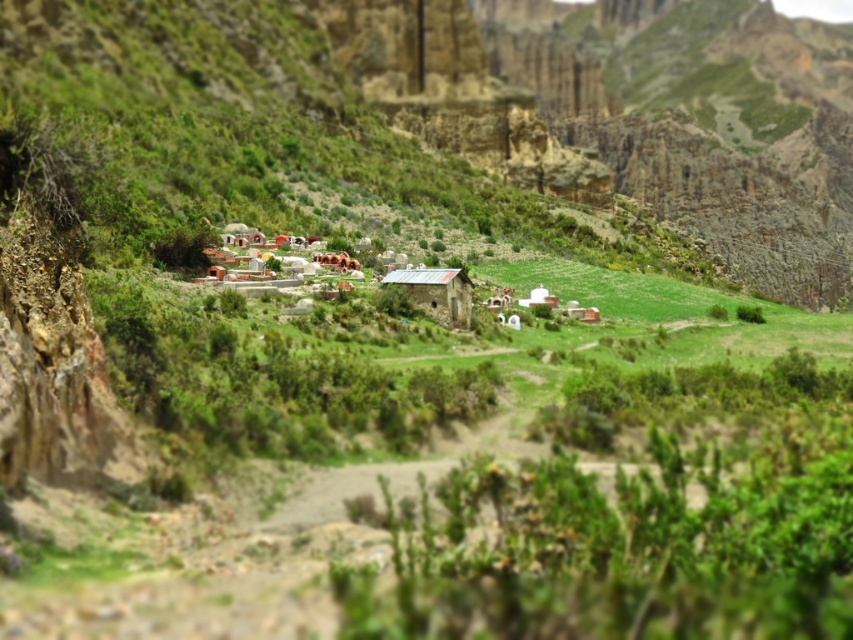
You are standing at the point with coordinates (538, 298) in a rural valley surrounded by mountains. You want to walk towards the nearest building. Which direction should you head?

The white matte hut at center is represented by point (538, 298), so you are already at the location of the white matte hut at center. Therefore, you don not need to move in any direction to reach the nearest building.

Based on the photo, you are a traveler approaching the settlement and notice two huts at the center. Which of the two huts, the white matte hut at center or the white clay hut at center, has a greater width?

The white matte hut at center has a greater width than the white clay hut at center according to the description.